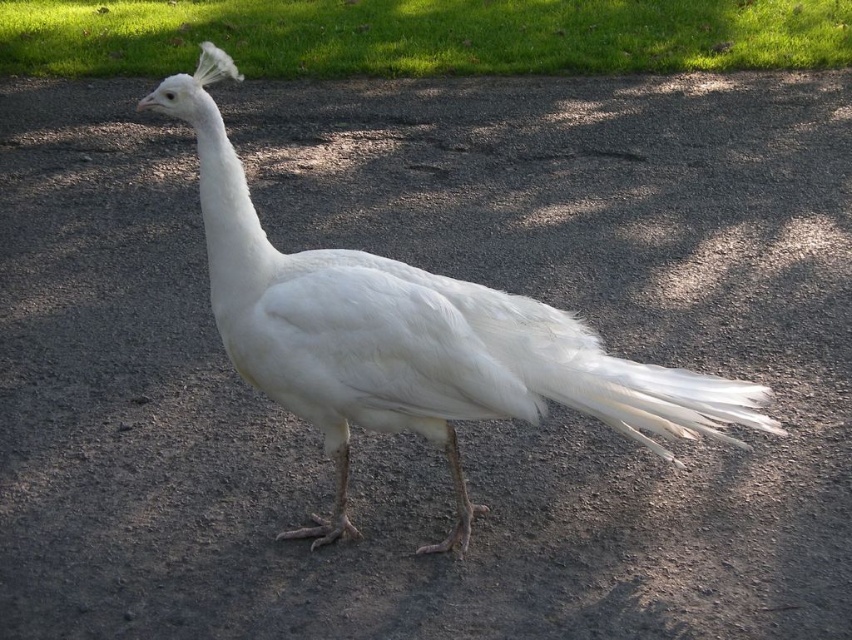
You are a photographer trying to capture the white feathered peacock at center and the green grass at upper center in a single shot. Based on their sizes in the image, which one would you need to focus on more closely to ensure it appears detailed in the photo?

The white feathered peacock at center is smaller than the green grass at upper center, so you would need to focus more closely on the white feathered peacock at center to ensure its details are captured clearly.

You are a small insect on the green grass at upper center and want to hide from a bird. Can you crawl under the white feathered tail at right to avoid being seen?

The green grass at upper center is taller than the white feathered tail at right, so crawling under the grass might not help you hide from the bird since the grass is taller than the tail.

You are a photographer trying to capture the white peacock in the image. You want to focus on the point at point [286,538] and point [557,371]. Which point should you adjust your focus to first if you want to start with the one closer to the camera?

Point [557,371] is closer to the camera than point [286,538], so you should adjust your focus to point [557,371] first.